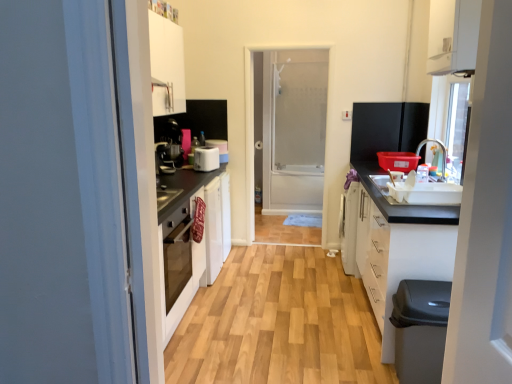
Question: Does transparent glass screen door at center have a lesser height compared to white plastic toaster at center?

Choices:
 (A) yes
 (B) no

Answer: (B)

Question: From a real-world perspective, is transparent glass screen door at center under white plastic toaster at center?

Choices:
 (A) no
 (B) yes

Answer: (A)

Question: From the image's perspective, does transparent glass screen door at center appear higher than white plastic toaster at center?

Choices:
 (A) yes
 (B) no

Answer: (A)

Question: Is transparent glass screen door at center smaller than white plastic toaster at center?

Choices:
 (A) no
 (B) yes

Answer: (A)

Question: Is transparent glass screen door at center touching white plastic toaster at center?

Choices:
 (A) no
 (B) yes

Answer: (A)

Question: From a real-world perspective, is transparent glass screen door at center physically above white plastic toaster at center?

Choices:
 (A) yes
 (B) no

Answer: (A)

Question: Is black plastic dishwasher at lower right next to matte black coffee machine at center-left?

Choices:
 (A) no
 (B) yes

Answer: (A)

Question: From a real-world perspective, does black plastic dishwasher at lower right stand above matte black coffee machine at center-left?

Choices:
 (A) yes
 (B) no

Answer: (B)

Question: Does black plastic dishwasher at lower right have a greater width compared to matte black coffee machine at center-left?

Choices:
 (A) yes
 (B) no

Answer: (A)

Question: Could you tell me if black plastic dishwasher at lower right is facing matte black coffee machine at center-left?

Choices:
 (A) no
 (B) yes

Answer: (A)

Question: Is black plastic dishwasher at lower right positioned beyond the bounds of matte black coffee machine at center-left?

Choices:
 (A) no
 (B) yes

Answer: (B)

Question: From the image's perspective, is black plastic dishwasher at lower right on top of matte black coffee machine at center-left?

Choices:
 (A) no
 (B) yes

Answer: (A)

Question: Is matte black coffee machine at center-left thinner than white matte cabinet at lower right, which appears as the first cabinetry when ordered from the bottom?

Choices:
 (A) no
 (B) yes

Answer: (B)